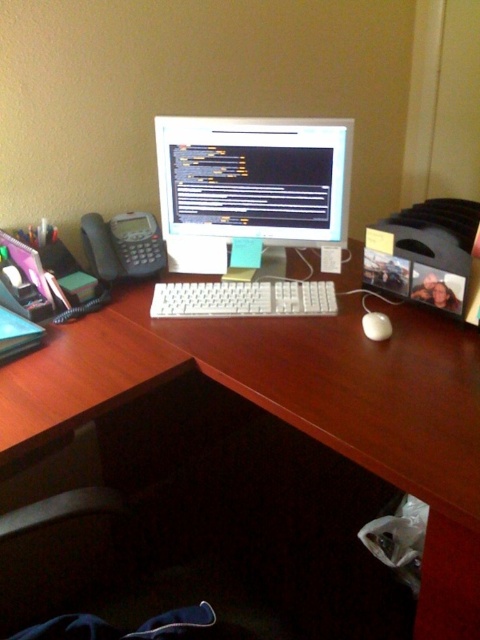
Between white plastic monitor at center and white matte mouse at center, which one is positioned lower?

white matte mouse at center is lower down.

Between white plastic monitor at center and white matte mouse at center, which one appears on the right side from the viewer's perspective?

white matte mouse at center

Which is in front, point (189, 300) or point (383, 320)?

Positioned in front is point (383, 320).

Locate an element on the screen. Image resolution: width=480 pixels, height=640 pixels. white plastic monitor at center is located at coordinates (250, 211).

Does white wood computer desk at center come behind white matte mouse at center?

No, white wood computer desk at center is in front of white matte mouse at center.

Can you confirm if white wood computer desk at center is taller than white matte mouse at center?

Correct, white wood computer desk at center is much taller as white matte mouse at center.

This screenshot has width=480, height=640. What do you see at coordinates (296, 406) in the screenshot?
I see `white wood computer desk at center` at bounding box center [296, 406].

Where is `white wood computer desk at center`? white wood computer desk at center is located at coordinates click(x=296, y=406).

Which of these two, white wood computer desk at center or white plastic monitor at center, stands taller?

With more height is white wood computer desk at center.

Based on the photo, does white wood computer desk at center have a larger size compared to white plastic monitor at center?

Yes.

Describe the element at coordinates (296, 406) in the screenshot. I see `white wood computer desk at center` at that location.

Identify the location of white wood computer desk at center. The height and width of the screenshot is (640, 480). [x=296, y=406].